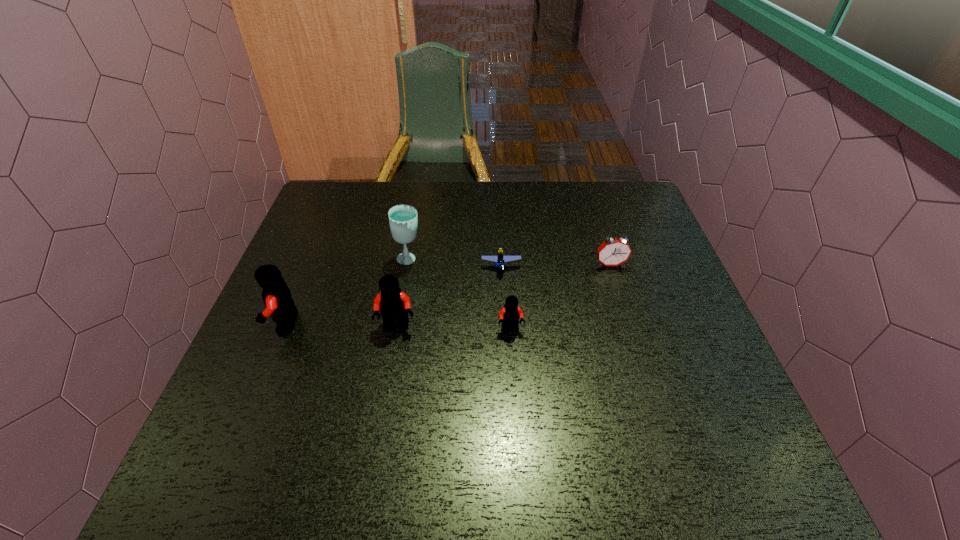
The height and width of the screenshot is (540, 960). Find the location of `the leftmost object`. the leftmost object is located at coordinates (276, 295).

I want to click on the third shortest Lego, so click(x=394, y=305).

At what (x,y) coordinates should I click in order to perform the action: click on the third tallest Lego. Please return your answer as a coordinate pair (x, y). Looking at the image, I should click on (509, 315).

You are a GUI agent. You are given a task and a screenshot of the screen. Output one action in this format:
    pyautogui.click(x=<x>, y=<y>)
    Task: Click on the shortest object
    The height and width of the screenshot is (540, 960).
    Given the screenshot: What is the action you would take?
    pyautogui.click(x=499, y=259)

Find the location of a particular element. The width and height of the screenshot is (960, 540). the farthest Lego is located at coordinates (499, 259).

The image size is (960, 540). In order to click on alarm clock in this screenshot , I will do `click(613, 251)`.

Find the location of `glass`. glass is located at coordinates (403, 219).

Locate an element on the screen. Image resolution: width=960 pixels, height=540 pixels. vacant space located 0.220m on the front-facing side of the second tallest Lego is located at coordinates (379, 427).

Where is `vacant space located on the front-facing side of the third tallest Lego`? The height and width of the screenshot is (540, 960). vacant space located on the front-facing side of the third tallest Lego is located at coordinates (513, 362).

At what (x,y) coordinates should I click in order to perform the action: click on vacant space located 0.110m on the front-facing side of the shortest object. Please return your answer as a coordinate pair (x, y). The width and height of the screenshot is (960, 540). Looking at the image, I should click on (503, 309).